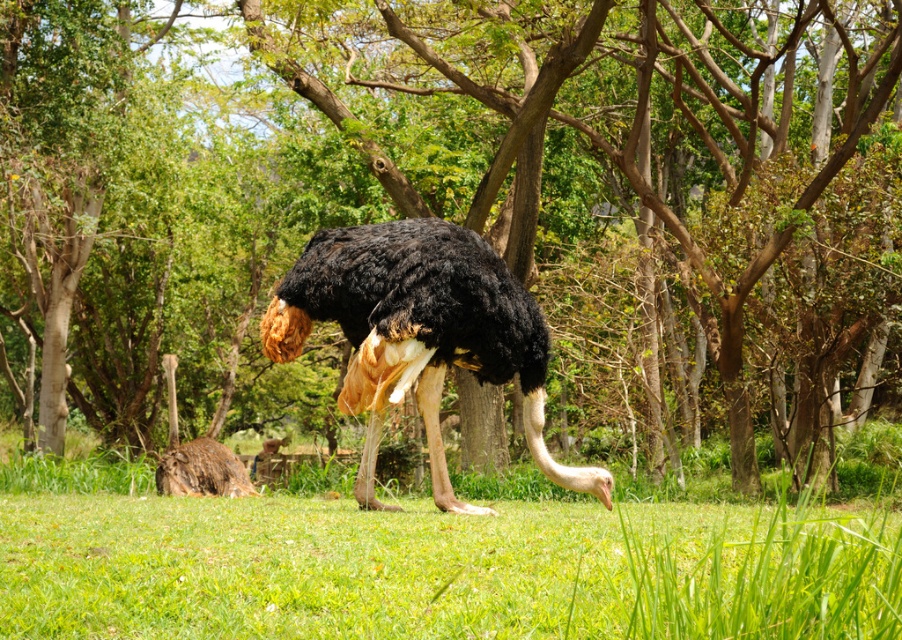
Is green grassy at center closer to the viewer compared to black feathered ostrich at center?

Yes.

Can you confirm if green grassy at center is smaller than black feathered ostrich at center?

Yes, green grassy at center is smaller than black feathered ostrich at center.

Identify the location of green grassy at center. (442, 568).

Does green grassy at center appear on the left side of brown feathered ostrich at lower left?

Incorrect, green grassy at center is not on the left side of brown feathered ostrich at lower left.

Between green grassy at center and brown feathered ostrich at lower left, which one appears on the left side from the viewer's perspective?

Positioned to the left is brown feathered ostrich at lower left.

Is point (98, 508) farther from camera compared to point (200, 436)?

No, it is not.

Identify the location of green grassy at center. (442, 568).

Which of these two, black feathered ostrich at center or brown feathered ostrich at lower left, stands taller?

With more height is black feathered ostrich at center.

Which is above, black feathered ostrich at center or brown feathered ostrich at lower left?

black feathered ostrich at center is higher up.

Is point (462, 248) farther from camera compared to point (238, 467)?

No, it is in front of (238, 467).

Find the location of a particular element. black feathered ostrich at center is located at coordinates (419, 333).